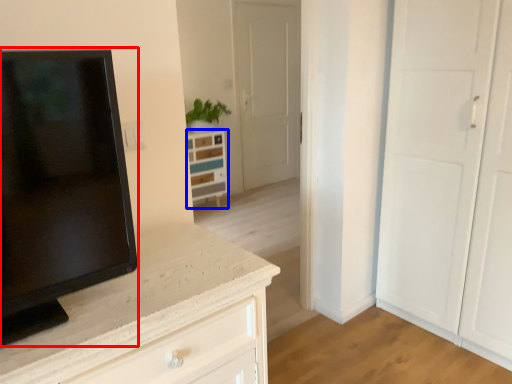
Question: Which point is further to the camera, screen (highlighted by a red box) or chest of drawers (highlighted by a blue box)?

Choices:
 (A) screen
 (B) chest of drawers

Answer: (B)